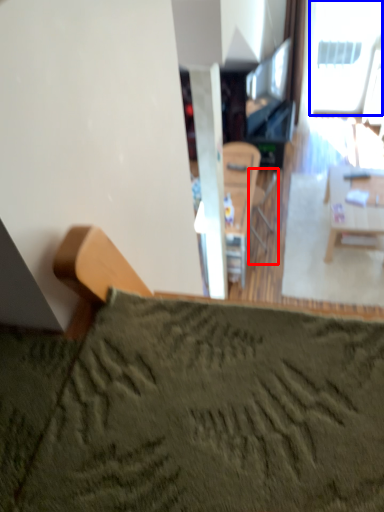
Question: Which object appears farthest to the camera in this image, armchair (highlighted by a red box) or window (highlighted by a blue box)?

Choices:
 (A) armchair
 (B) window

Answer: (B)